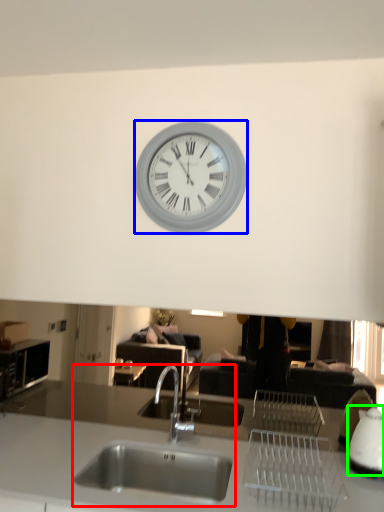
Question: Which object is the closest to the sink (highlighted by a red box)? Choose among these: wall clock (highlighted by a blue box) or appliance (highlighted by a green box).

Choices:
 (A) wall clock
 (B) appliance

Answer: (B)